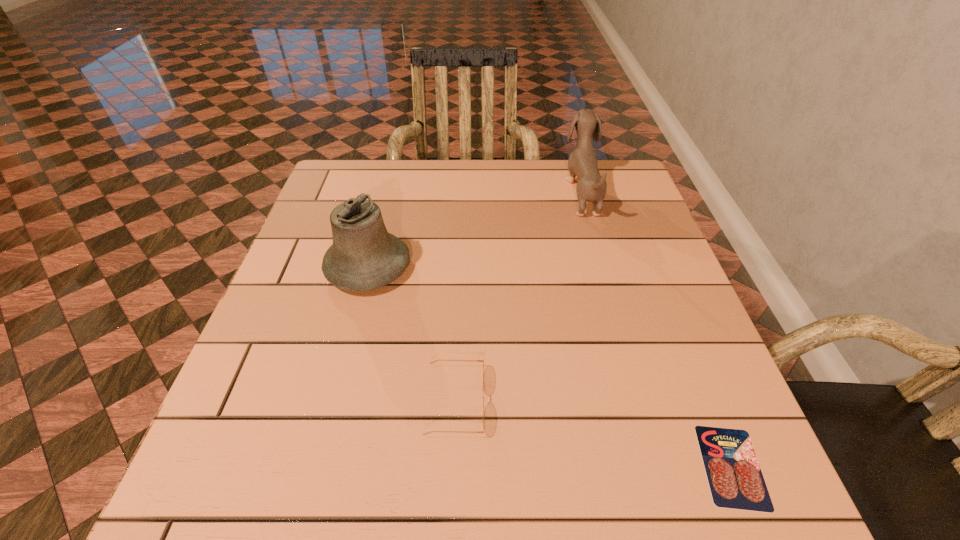
The image size is (960, 540). What are the coordinates of `object that is at the near right corner` in the screenshot? It's located at (734, 475).

Identify the location of vacant space at the far edge. The height and width of the screenshot is (540, 960). (454, 168).

Where is `vacant space at the near edge`? The image size is (960, 540). vacant space at the near edge is located at coordinates (491, 498).

Identify the location of vacant space at the left edge of the desktop. (309, 254).

At what (x,y) coordinates should I click in order to perform the action: click on vacant space at the right edge of the desktop. Please return your answer as a coordinate pair (x, y). Image resolution: width=960 pixels, height=540 pixels. Looking at the image, I should click on pos(636,207).

In the image, there is a desktop. Where is `free space at the far left corner`? This screenshot has width=960, height=540. free space at the far left corner is located at coordinates (333, 171).

What are the coordinates of `vacant space at the near right corner of the desktop` in the screenshot? It's located at (700, 474).

The width and height of the screenshot is (960, 540). In order to click on unoccupied position between the third tallest object and the salami in this screenshot , I will do `click(593, 434)`.

Where is `free space between the leftmost object and the shortest object`? The width and height of the screenshot is (960, 540). free space between the leftmost object and the shortest object is located at coordinates (550, 367).

At what (x,y) coordinates should I click in order to perform the action: click on free spot between the third object from left to right and the rightmost object. Please return your answer as a coordinate pair (x, y). Looking at the image, I should click on (657, 329).